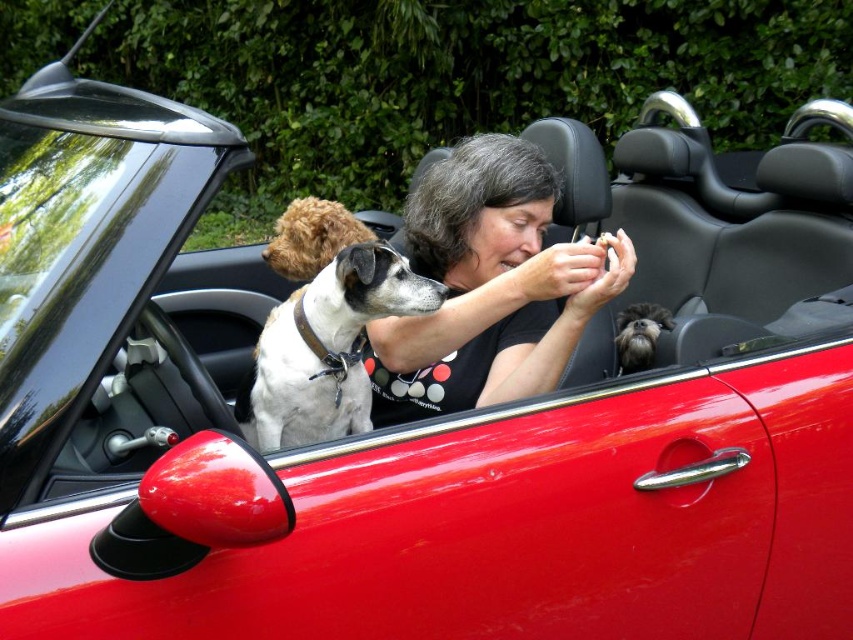
Looking at this image, you are a delivery person who needs to place a small package between the black matte shirt at center and the red convertible car parked outdoors. Can you fit the package there?

The distance between the black matte shirt at center and the red convertible car parked outdoors is 4.62 feet, so yes, the package can be placed there as there is enough space.

You are a dog trainer observing the scene. You need to fit a harness for the white fur dog at center and the shiny brown fur at center. Which dog requires a wider harness?

The white fur dog at center requires a wider harness because it is wider than the shiny brown fur at center according to the description.